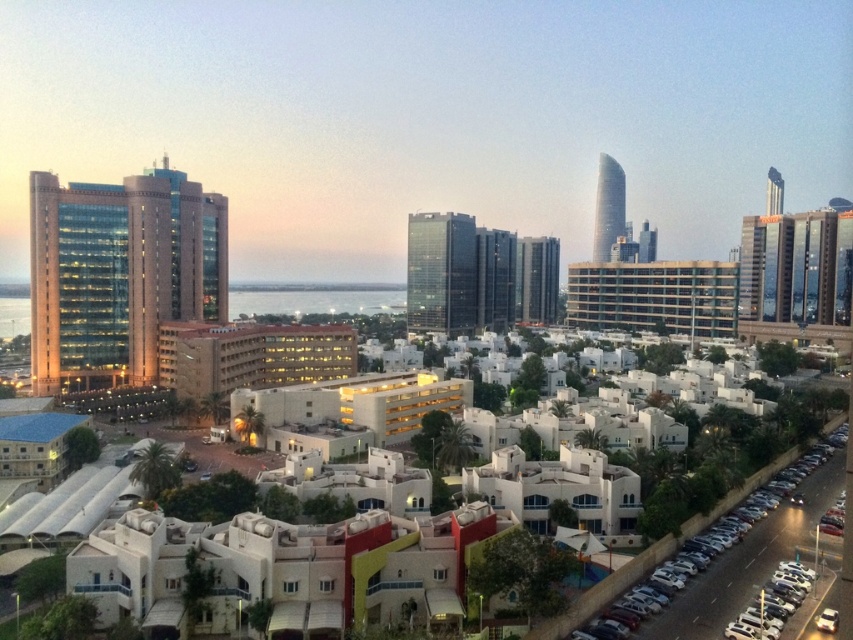
Question: Is metallic silver car at lower right thinner than silver metallic car at lower right?

Choices:
 (A) yes
 (B) no

Answer: (B)

Question: Is metallic silver car at lower right thinner than silver metallic car at lower right?

Choices:
 (A) yes
 (B) no

Answer: (B)

Question: Which of the following is the farthest from the observer?

Choices:
 (A) (592, 592)
 (B) (762, 608)

Answer: (A)

Question: Can you confirm if metallic silver car at lower right is positioned below silver metallic car at lower right?

Choices:
 (A) yes
 (B) no

Answer: (B)